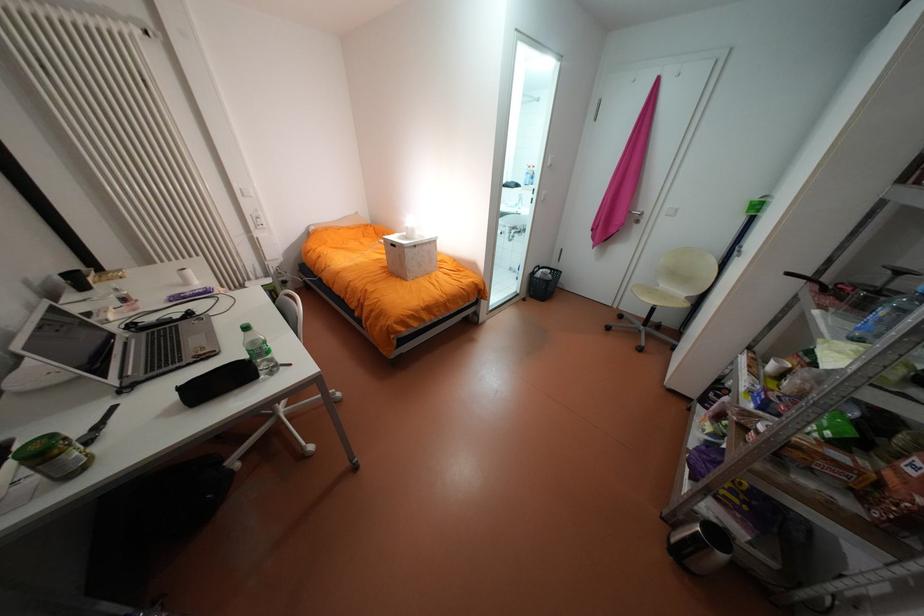
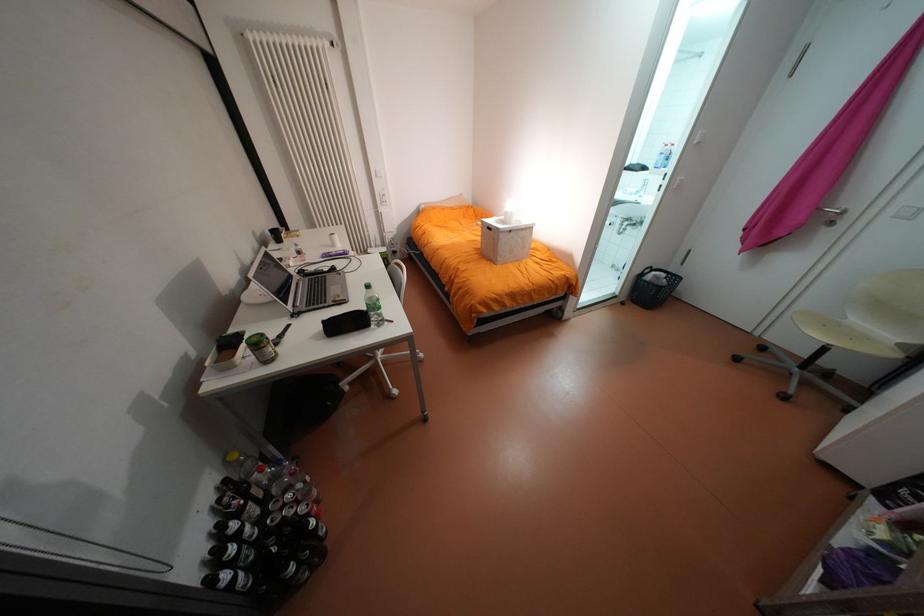
Where in the second image is the point corresponding to [551,270] from the first image?

(663, 273)